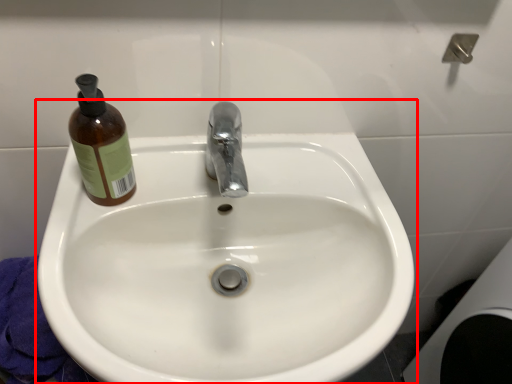
Question: Where is sink (annotated by the red box) located in relation to bottle in the image?

Choices:
 (A) right
 (B) left

Answer: (A)